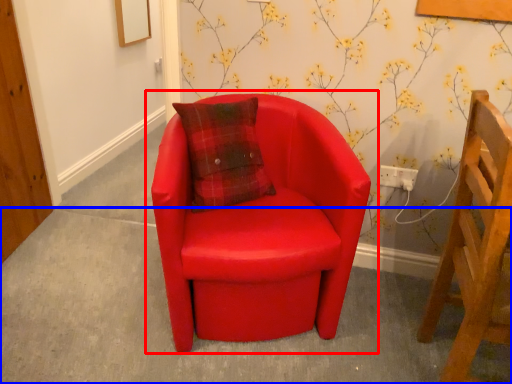
Question: Which object is further to the camera taking this photo, chair (highlighted by a red box) or concrete (highlighted by a blue box)?

Choices:
 (A) chair
 (B) concrete

Answer: (B)